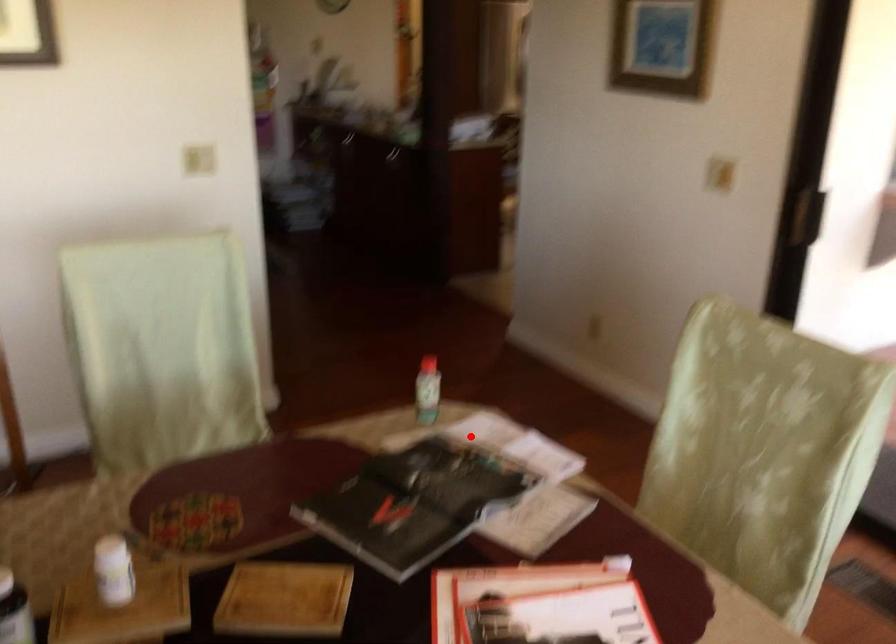
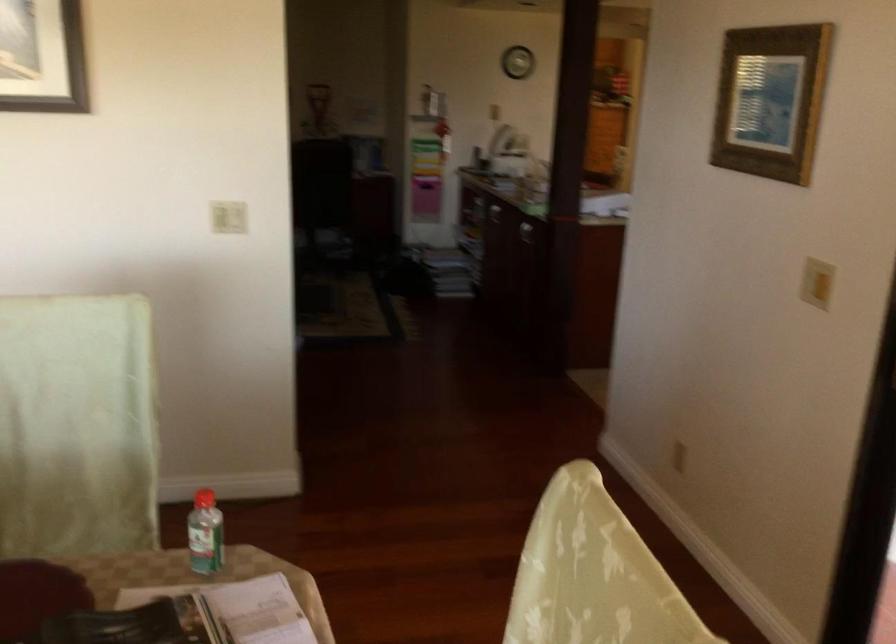
Find the pixel in the second image that matches the highlighted location in the first image.

(238, 609)